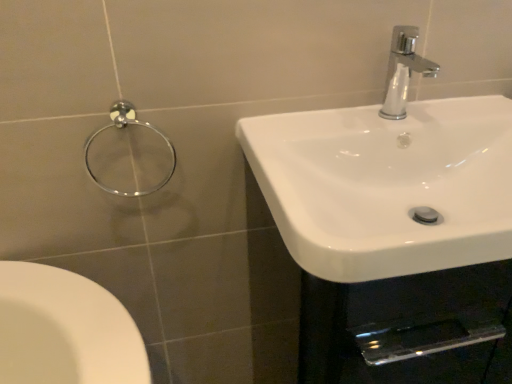
Question: From their relative heights in the image, would you say chrome metallic towel ring at upper left is taller or shorter than chrome metallic faucet at upper right?

Choices:
 (A) tall
 (B) short

Answer: (A)

Question: In terms of size, does chrome metallic towel ring at upper left appear bigger or smaller than chrome metallic faucet at upper right?

Choices:
 (A) big
 (B) small

Answer: (A)

Question: Which object is positioned farthest from the chrome metallic faucet at upper right?

Choices:
 (A) white glossy sink at right
 (B) chrome metallic towel ring at upper left

Answer: (B)

Question: Which of these objects is positioned farthest from the white glossy sink at right?

Choices:
 (A) chrome metallic towel ring at upper left
 (B) chrome metallic faucet at upper right

Answer: (A)